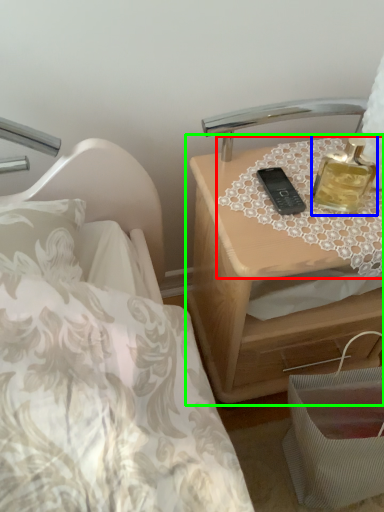
Question: Based on their relative distances, which object is farther from tablecloth (highlighted by a red box)? Choose from perfume (highlighted by a blue box) and nightstand (highlighted by a green box).

Choices:
 (A) perfume
 (B) nightstand

Answer: (B)